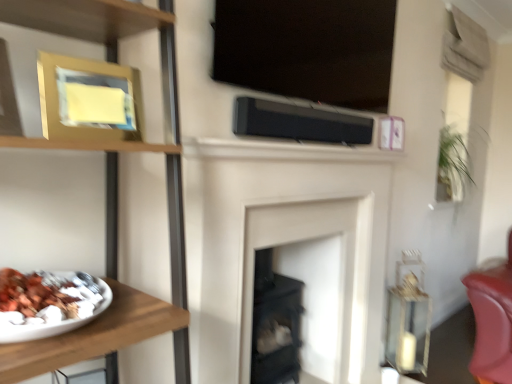
Identify the location of vacant space situated above black matte speaker at center (from a real-world perspective). click(x=308, y=106).